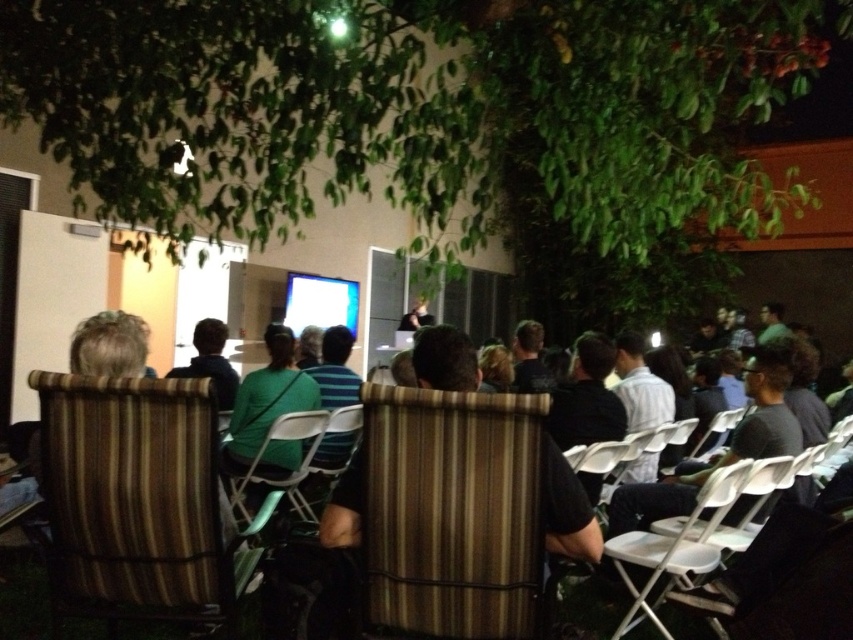
You are attending a presentation and want to see the white glossy projection screen at center clearly. Is the green fabric chair at center blocking your view of the screen?

The green fabric chair at center is in front of the white glossy projection screen at center, so it is blocking the view of the screen.

You are an event organizer and need to arrange a VIP section. The green striped chair at center and the striped fabric chair at center are available. Which chair should you place higher up to give a better view?

The striped fabric chair at center should be placed higher up because the green striped chair at center is currently positioned below it.

You are an event planner arranging seating for a presentation. You need to ensure that the green striped chair at center and the striped fabric chair at center are positioned so that the presenter can see both. Based on their current positions, which chair is closer to the front of the stage?

The green striped chair at center is closer to the front of the stage because it is in front of the striped fabric chair at center.